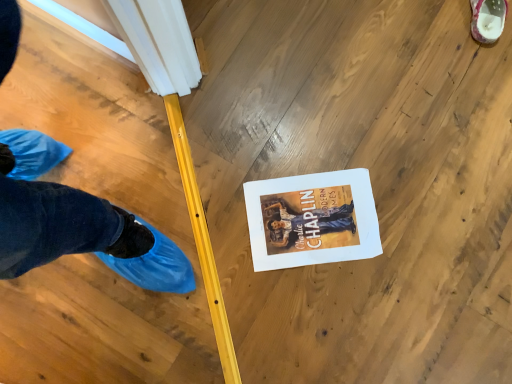
Question: Should I look upward or downward to see white paper at center?

Choices:
 (A) down
 (B) up

Answer: (A)

Question: Can you confirm if white textured shoe at upper right is smaller than white paper at center?

Choices:
 (A) no
 (B) yes

Answer: (A)

Question: From a real-world perspective, is white textured shoe at upper right positioned over white paper at center based on gravity?

Choices:
 (A) no
 (B) yes

Answer: (B)

Question: From the image's perspective, is white textured shoe at upper right over white paper at center?

Choices:
 (A) no
 (B) yes

Answer: (B)

Question: Is white textured shoe at upper right turned away from white paper at center?

Choices:
 (A) yes
 (B) no

Answer: (B)

Question: Is white textured shoe at upper right wider than white paper at center?

Choices:
 (A) yes
 (B) no

Answer: (B)

Question: Is white textured shoe at upper right not near white paper at center?

Choices:
 (A) no
 (B) yes

Answer: (A)

Question: Can you confirm if white paper at center is positioned to the right of white textured shoe at upper right?

Choices:
 (A) yes
 (B) no

Answer: (B)

Question: Does white paper at center have a lesser height compared to white textured shoe at upper right?

Choices:
 (A) no
 (B) yes

Answer: (B)

Question: Is white paper at center far from white textured shoe at upper right?

Choices:
 (A) yes
 (B) no

Answer: (B)

Question: From a real-world perspective, is white paper at center physically above white textured shoe at upper right?

Choices:
 (A) yes
 (B) no

Answer: (B)

Question: Is white textured shoe at upper right inside white paper at center?

Choices:
 (A) yes
 (B) no

Answer: (B)

Question: From the image's perspective, is white paper at center below white textured shoe at upper right?

Choices:
 (A) no
 (B) yes

Answer: (B)

Question: Considering their positions, is white paper at center located in front of or behind white textured shoe at upper right?

Choices:
 (A) behind
 (B) front

Answer: (B)